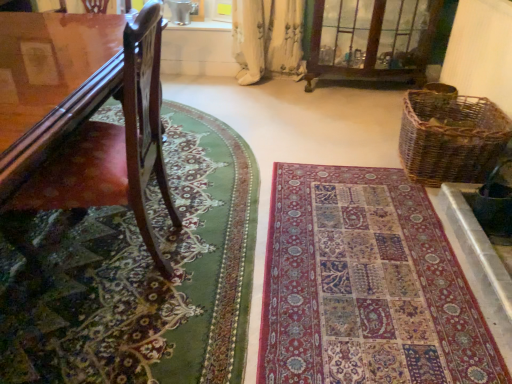
Where is `free space to the back side of woven brown picnic basket at right`? free space to the back side of woven brown picnic basket at right is located at coordinates (372, 128).